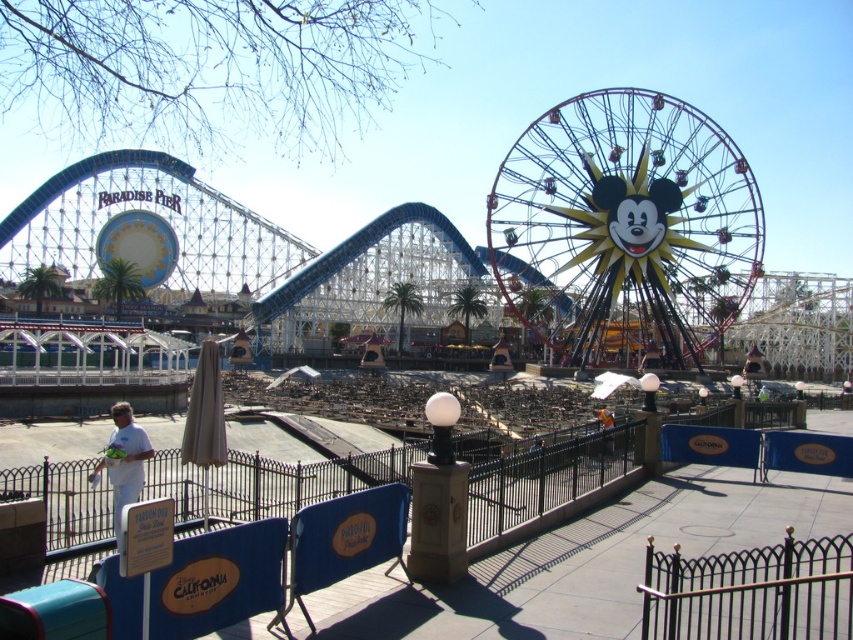
Based on the coordinates provided in the description, where is the metallic yellow ferris wheel at center located in the image?

The metallic yellow ferris wheel at center is located at point coordinates of (625, 228).

You are standing at the point marked by the coordinates point [625,228]. What large structure are you currently on?

The point [625,228] is on the metallic yellow ferris wheel at center, so you are currently on the metallic yellow ferris wheel at center.

You are standing on the pier and want to take a photo of the metallic yellow ferris wheel at center and the white matte shirt at lower left. Which object should you position to the right side of your camera frame?

You should position the metallic yellow ferris wheel at center to the right side of your camera frame because it is already located to the right of the white matte shirt at lower left.